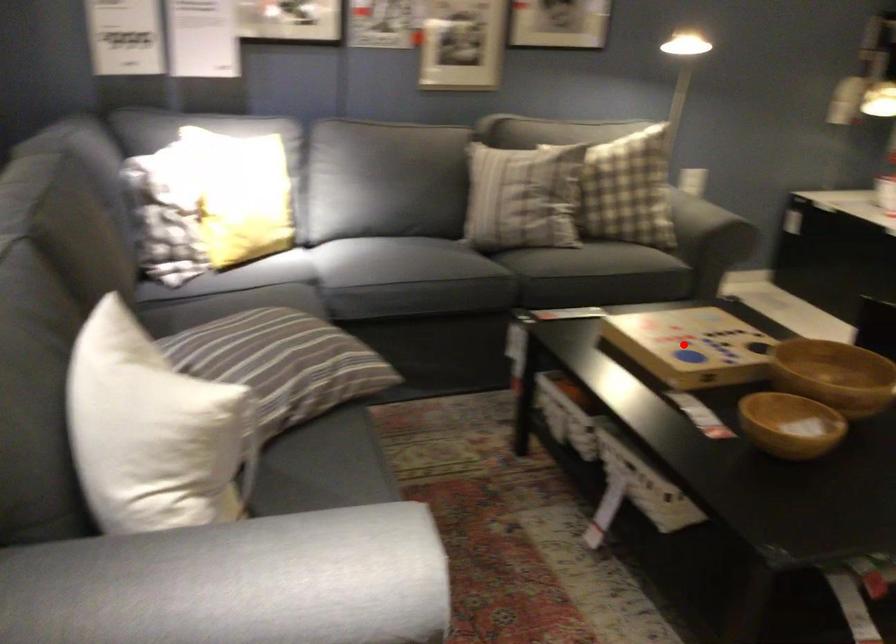
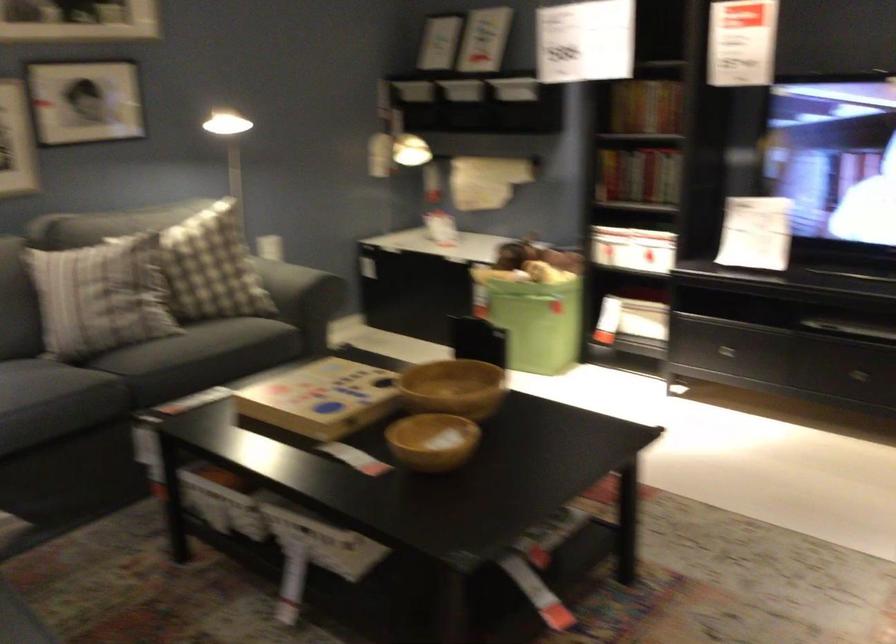
Question: I am providing you with two images of the same scene from different viewpoints. A red point is marked on the first image. At the location where the point appears in image 1, is it still visible in image 2?

Choices:
 (A) Yes
 (B) No

Answer: (A)